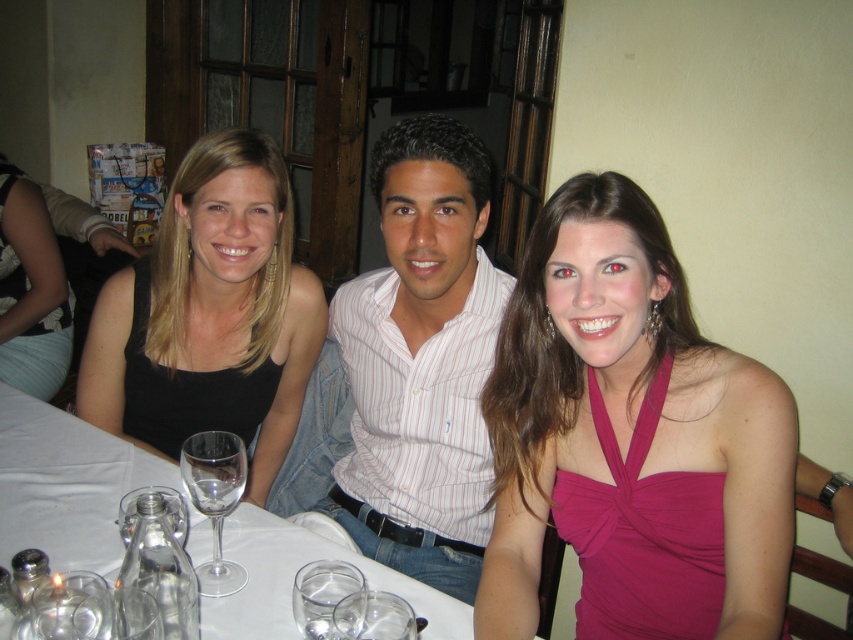
You are a waiter at this restaurant and need to place a 12 inch long dessert plate between the pink satin dress at center and the transparent glass wine glass at lower left. Will there be enough space?

The distance between the pink satin dress at center and the transparent glass wine glass at lower left is 18.74 inches. Since the dessert plate is 12 inches long, there is sufficient space to place it between them.

You are a photographer taking a picture of the three people at the table. You need to place a small prop exactly where the black matte dress at left is located. What are the coordinates where you should place it?

The coordinates for placing the prop should be at point [210,314] where the black matte dress at left is located.